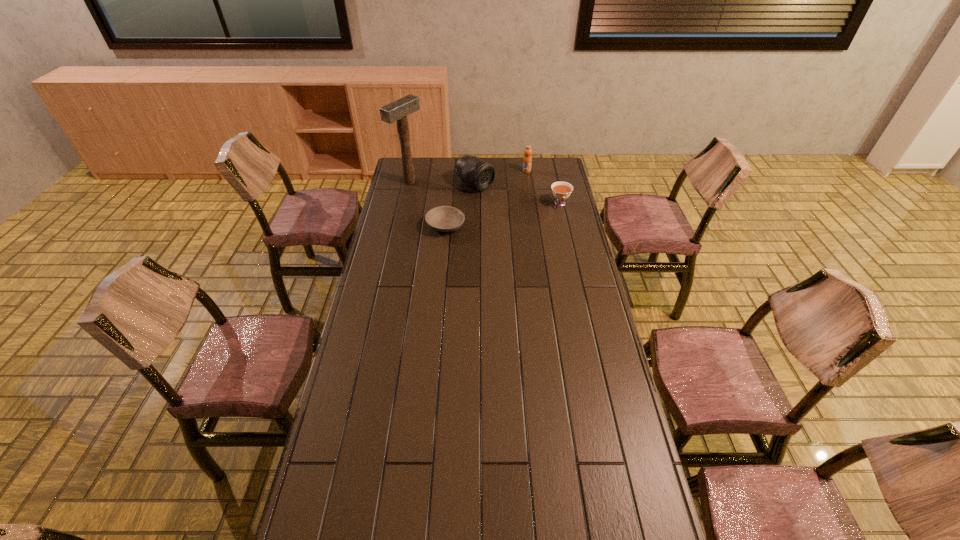
The image size is (960, 540). Find the location of `free space on the desktop that is between the nearest object and the fourth tallest object and is positioned on the striking surface of the mallet`. free space on the desktop that is between the nearest object and the fourth tallest object and is positioned on the striking surface of the mallet is located at coordinates (491, 218).

Identify the location of vacant space on the desktop that is between the nearest object and the fourth tallest object and is positioned on the surface of the telephoto lens. (521, 212).

Locate an element on the screen. vacant space on the desktop that is between the nearest object and the teacup and is positioned on the front label of the orange juice is located at coordinates (512, 213).